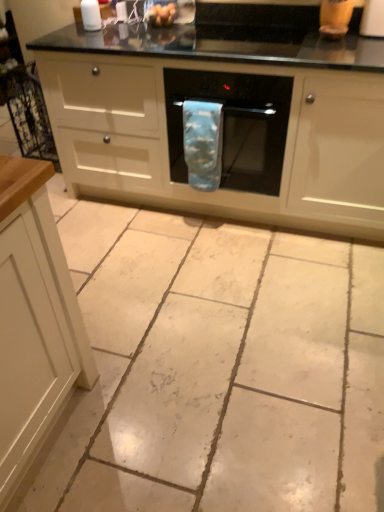
This screenshot has height=512, width=384. Describe the element at coordinates (217, 368) in the screenshot. I see `white tile floor at center` at that location.

This screenshot has width=384, height=512. What are the coordinates of `black glass oven at center` in the screenshot? It's located at [231, 130].

Locate an element on the screen. The image size is (384, 512). smooth plastic eggs at upper center is located at coordinates (161, 14).

Image resolution: width=384 pixels, height=512 pixels. What are the coordinates of `white glossy salt shaker at upper left` in the screenshot? It's located at (91, 15).

Find the location of a particular element. This screenshot has width=384, height=512. white tile floor at center is located at coordinates (217, 368).

In the scene shown: Which object is thinner, black glass oven at center or white glossy salt shaker at upper left?

Thinner between the two is white glossy salt shaker at upper left.

Which is in front, point (326, 42) or point (92, 30)?

Point (326, 42)

Looking at this image, is black glass oven at center spatially inside white glossy salt shaker at upper left, or outside of it?

black glass oven at center is not enclosed by white glossy salt shaker at upper left.

Does black glass oven at center have a greater height compared to white glossy salt shaker at upper left?

Indeed, black glass oven at center has a greater height compared to white glossy salt shaker at upper left.

How distant is black glass oven at center from blue fabric oven mitt at center?

The distance of black glass oven at center from blue fabric oven mitt at center is 6.18 inches.

How different are the orientations of black glass oven at center and blue fabric oven mitt at center in degrees?

black glass oven at center and blue fabric oven mitt at center are facing 0.294 degrees away from each other.

From the image's perspective, is black glass oven at center beneath blue fabric oven mitt at center?

Yes.

Is black glass oven at center oriented towards blue fabric oven mitt at center?

Yes, black glass oven at center is aimed at blue fabric oven mitt at center.

From the picture: Is white tile floor at center next to smooth plastic eggs at upper center and touching it?

No.

From the image's perspective, which is below, white tile floor at center or smooth plastic eggs at upper center?

white tile floor at center is shown below in the image.

In the scene shown: From a real-world perspective, is white tile floor at center on smooth plastic eggs at upper center?

No, from a real-world perspective, white tile floor at center is not over smooth plastic eggs at upper center

Does point (105, 291) lie in front of point (159, 15)?

Yes.

Would you consider white glossy salt shaker at upper left to be distant from black glass oven at center?

white glossy salt shaker at upper left is actually quite close to black glass oven at center.

How different are the orientations of white glossy salt shaker at upper left and black glass oven at center in degrees?

They differ by 0.231 degrees in their facing directions.

Is white glossy salt shaker at upper left taller than black glass oven at center?

In fact, white glossy salt shaker at upper left may be shorter than black glass oven at center.

Does white glossy salt shaker at upper left come behind black glass oven at center?

Yes, white glossy salt shaker at upper left is further from the viewer.

Considering the relative sizes of blue fabric towel at center and blue fabric oven mitt at center in the image provided, is blue fabric towel at center wider than blue fabric oven mitt at center?

No.

Which is more to the left, blue fabric towel at center or blue fabric oven mitt at center?

blue fabric towel at center.

Is blue fabric oven mitt at center surrounded by blue fabric towel at center?

No, blue fabric towel at center does not contain blue fabric oven mitt at center.

Based on the photo, is blue fabric towel at center placed right next to blue fabric oven mitt at center?

No.

Is white glossy salt shaker at upper left oriented away from blue fabric towel at center?

No.

Considering the sizes of objects white glossy salt shaker at upper left and blue fabric towel at center in the image provided, who is smaller, white glossy salt shaker at upper left or blue fabric towel at center?

white glossy salt shaker at upper left is smaller.

Is point (83, 5) less distant than point (217, 188)?

No, it is behind (217, 188).

Which object is closer to the camera taking this photo, blue fabric towel at center or white glossy salt shaker at upper left?

blue fabric towel at center is closer to the camera.

How far apart are blue fabric towel at center and white glossy salt shaker at upper left?

blue fabric towel at center is 35.88 inches away from white glossy salt shaker at upper left.

Considering the sizes of blue fabric towel at center and white glossy salt shaker at upper left in the image, is blue fabric towel at center bigger or smaller than white glossy salt shaker at upper left?

Clearly, blue fabric towel at center is larger in size than white glossy salt shaker at upper left.

Which is behind, point (208, 162) or point (85, 1)?

The point (85, 1) is behind.

Locate an element on the screen. oven in front of the white glossy salt shaker at upper left is located at coordinates 231,130.

Locate an element on the screen. This screenshot has height=512, width=384. oven on the left side of blue fabric oven mitt at center is located at coordinates (231, 130).

Which object lies nearer to the anchor point black glass oven at center, blue fabric towel at center or blue fabric oven mitt at center?

blue fabric oven mitt at center is positioned closer to the anchor black glass oven at center.

When comparing their distances from smooth plastic eggs at upper center, does blue fabric oven mitt at center or blue fabric towel at center seem closer?

Among the two, blue fabric towel at center is located nearer to smooth plastic eggs at upper center.

Based on their spatial positions, is smooth plastic eggs at upper center or blue fabric oven mitt at center closer to black glass oven at center?

Based on the image, blue fabric oven mitt at center appears to be nearer to black glass oven at center.

From the image, which object appears to be farther from blue fabric towel at center, white glossy salt shaker at upper left or white tile floor at center?

white glossy salt shaker at upper left.

Based on their spatial positions, is blue fabric towel at center or black glass oven at center further from smooth plastic eggs at upper center?

The object further to smooth plastic eggs at upper center is black glass oven at center.

Estimate the real-world distances between objects in this image. Which object is closer to white glossy salt shaker at upper left, blue fabric oven mitt at center or black glass oven at center?

black glass oven at center is closer to white glossy salt shaker at upper left.

When comparing their distances from blue fabric oven mitt at center, does black glass oven at center or blue fabric towel at center seem further?

black glass oven at center is further to blue fabric oven mitt at center.

From the image, which object appears to be farther from white glossy salt shaker at upper left, blue fabric oven mitt at center or smooth plastic eggs at upper center?

blue fabric oven mitt at center is positioned further to the anchor white glossy salt shaker at upper left.

The height and width of the screenshot is (512, 384). In order to click on oven between smooth plastic eggs at upper center and blue fabric towel at center from top to bottom in this screenshot , I will do `click(231, 130)`.

The image size is (384, 512). I want to click on kitchen appliance between smooth plastic eggs at upper center and blue fabric towel at center from top to bottom, so click(91, 15).

The image size is (384, 512). Find the location of `kitchen appliance between smooth plastic eggs at upper center and white tile floor at center from top to bottom`. kitchen appliance between smooth plastic eggs at upper center and white tile floor at center from top to bottom is located at coordinates (91, 15).

I want to click on home appliance located between black glass oven at center and blue fabric towel at center in the depth direction, so click(234, 125).